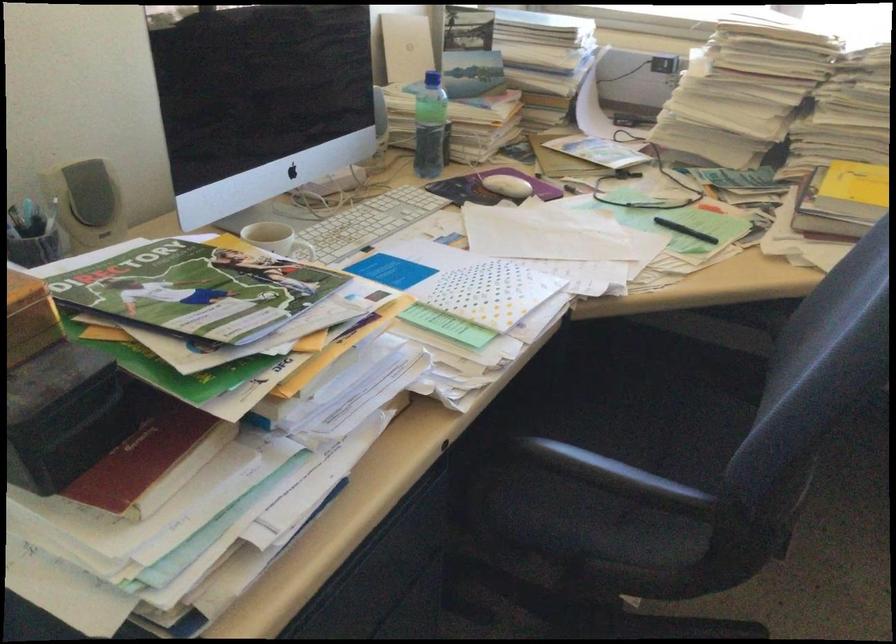
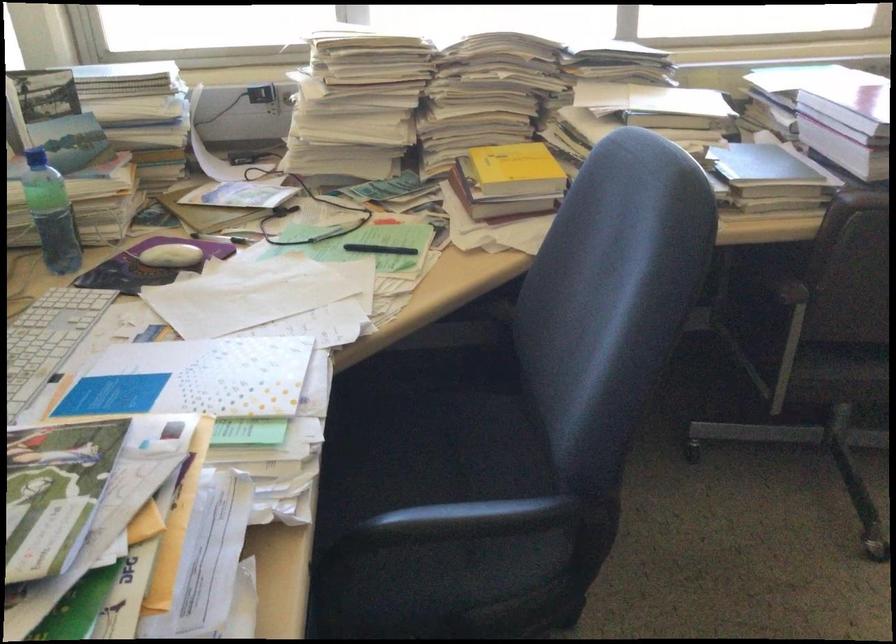
Question: The camera is either moving clockwise (left) or counter-clockwise (right) around the object. The first image is from the beginning of the video and the second image is from the end. Is the camera moving left or right when shooting the video?

Choices:
 (A) Left
 (B) Right

Answer: (A)